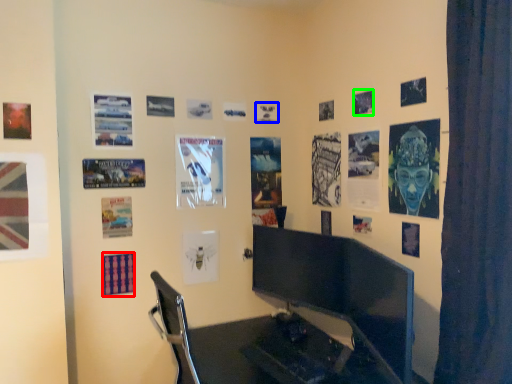
Question: Which object is positioned closest to poster page (highlighted by a red box)? Select from poster page (highlighted by a blue box) and poster page (highlighted by a green box).

Choices:
 (A) poster page
 (B) poster page

Answer: (A)